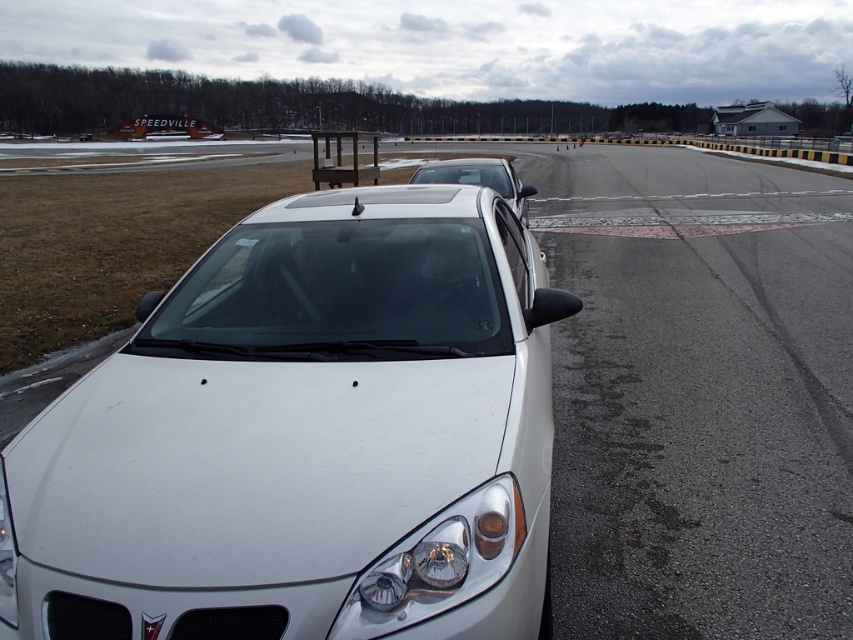
Is point (457, 417) more distant than point (502, 544)?

Yes, it is.

Measure the distance from white glossy sedan at center to glossy plastic headlight at center.

They are 25.86 inches apart.

The height and width of the screenshot is (640, 853). What do you see at coordinates (305, 436) in the screenshot?
I see `white glossy sedan at center` at bounding box center [305, 436].

In order to click on white glossy sedan at center in this screenshot , I will do `click(305, 436)`.

Between white glossy sedan at center and satin white sedan at center, which one appears on the left side from the viewer's perspective?

white glossy sedan at center is more to the left.

Can you confirm if white glossy sedan at center is wider than satin white sedan at center?

In fact, white glossy sedan at center might be narrower than satin white sedan at center.

Does point (318, 259) lie behind point (508, 168)?

No, it is in front of (508, 168).

Locate an element on the screen. This screenshot has width=853, height=640. white glossy sedan at center is located at coordinates (305, 436).

Between glossy plastic headlight at center and satin white sedan at center, which one appears on the left side from the viewer's perspective?

glossy plastic headlight at center is more to the left.

Is glossy plastic headlight at center wider than satin white sedan at center?

No, glossy plastic headlight at center is not wider than satin white sedan at center.

Locate an element on the screen. The height and width of the screenshot is (640, 853). glossy plastic headlight at center is located at coordinates (437, 563).

Where is `glossy plastic headlight at center`? glossy plastic headlight at center is located at coordinates (437, 563).